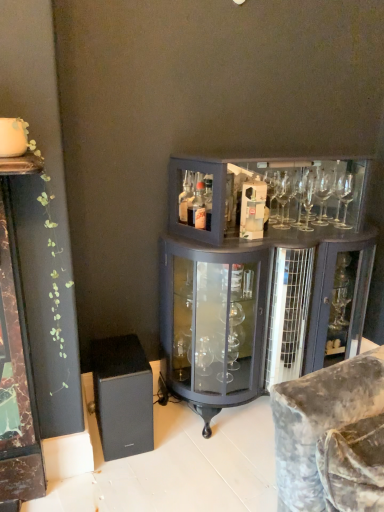
Where is `free spot to the right of black matte speaker at lower left`? This screenshot has width=384, height=512. free spot to the right of black matte speaker at lower left is located at coordinates (182, 434).